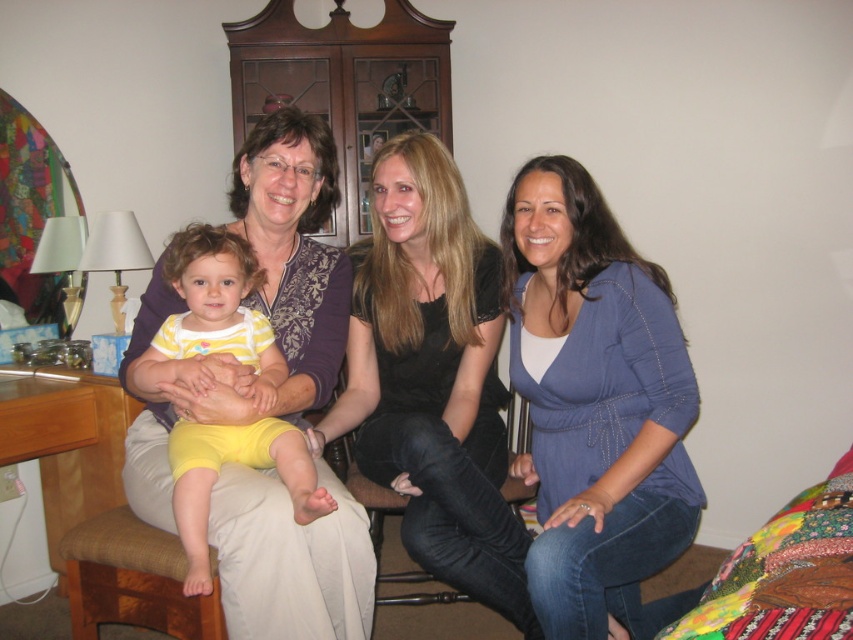
Question: Is matte blue blouse at center closer to the viewer compared to yellow cotton shorts at left?

Choices:
 (A) no
 (B) yes

Answer: (A)

Question: Which point is closer to the camera?

Choices:
 (A) matte blue blouse at center
 (B) black matte shirt at center
 (C) matte black shirt at center

Answer: (A)

Question: From the image, what is the correct spatial relationship of matte black shirt at center in relation to matte blue blouse at center?

Choices:
 (A) above
 (B) below

Answer: (B)

Question: Which object is the closest to the yellow cotton shorts at left?

Choices:
 (A) black matte shirt at center
 (B) matte blue blouse at center
 (C) matte black shirt at center

Answer: (C)

Question: Which of the following is the closest to the observer?

Choices:
 (A) yellow cotton shorts at left
 (B) black matte shirt at center
 (C) matte blue blouse at center

Answer: (A)

Question: Can you confirm if matte black shirt at center is bigger than matte blue blouse at center?

Choices:
 (A) yes
 (B) no

Answer: (A)